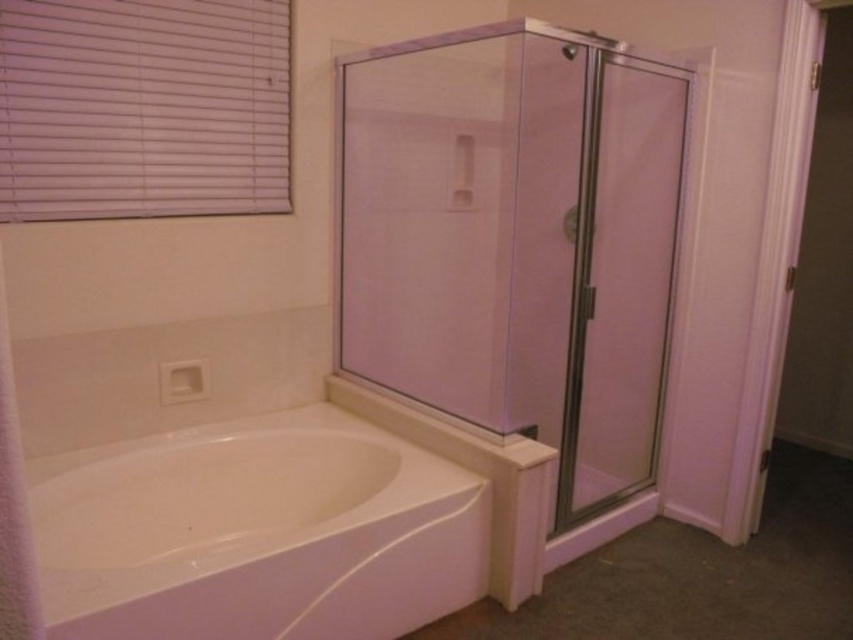
Who is positioned more to the left, clear glass shower door at right or white soft towel at left?

From the viewer's perspective, white soft towel at left appears more on the left side.

Can you confirm if clear glass shower door at right is shorter than white soft towel at left?

No.

What are the coordinates of `clear glass shower door at right` in the screenshot? It's located at (619, 280).

Where is `clear glass shower door at right`? clear glass shower door at right is located at coordinates (619, 280).

Measure the distance between clear glass shower door at center and white glossy bathtub at lower left.

clear glass shower door at center and white glossy bathtub at lower left are 84.19 centimeters apart.

The height and width of the screenshot is (640, 853). What do you see at coordinates (517, 241) in the screenshot?
I see `clear glass shower door at center` at bounding box center [517, 241].

Is point (573, 180) farther from viewer compared to point (387, 442)?

Yes, it is behind point (387, 442).

You are a GUI agent. You are given a task and a screenshot of the screen. Output one action in this format:
    pyautogui.click(x=<x>, y=<y>)
    Task: Click on the clear glass shower door at center
    
    Given the screenshot: What is the action you would take?
    pyautogui.click(x=517, y=241)

What do you see at coordinates (142, 108) in the screenshot? Image resolution: width=853 pixels, height=640 pixels. I see `white plastic blinds at upper left` at bounding box center [142, 108].

Is white plastic blinds at upper left in front of clear glass shower door at right?

Yes, white plastic blinds at upper left is closer to the viewer.

Locate an element on the screen. white plastic blinds at upper left is located at coordinates (142, 108).

The width and height of the screenshot is (853, 640). I want to click on white plastic blinds at upper left, so click(142, 108).